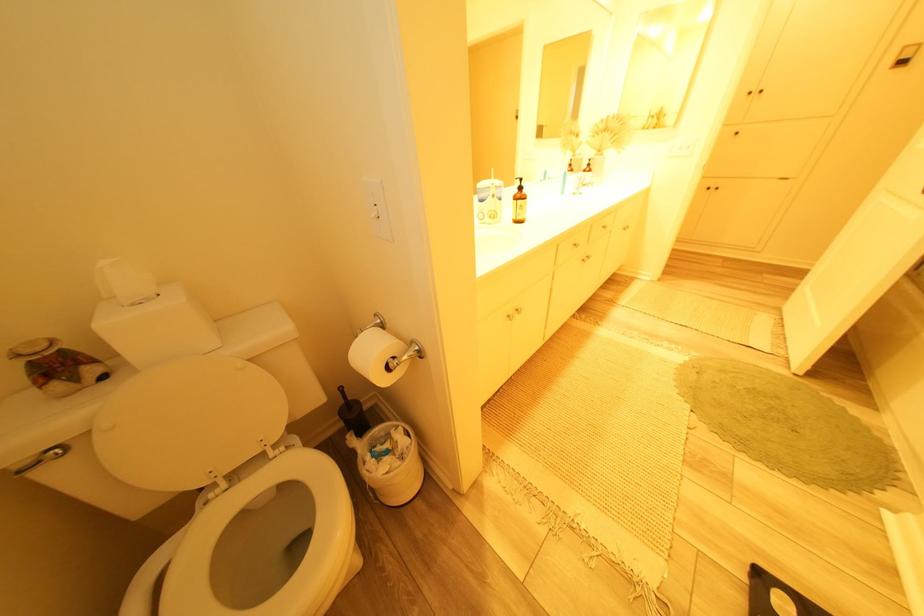
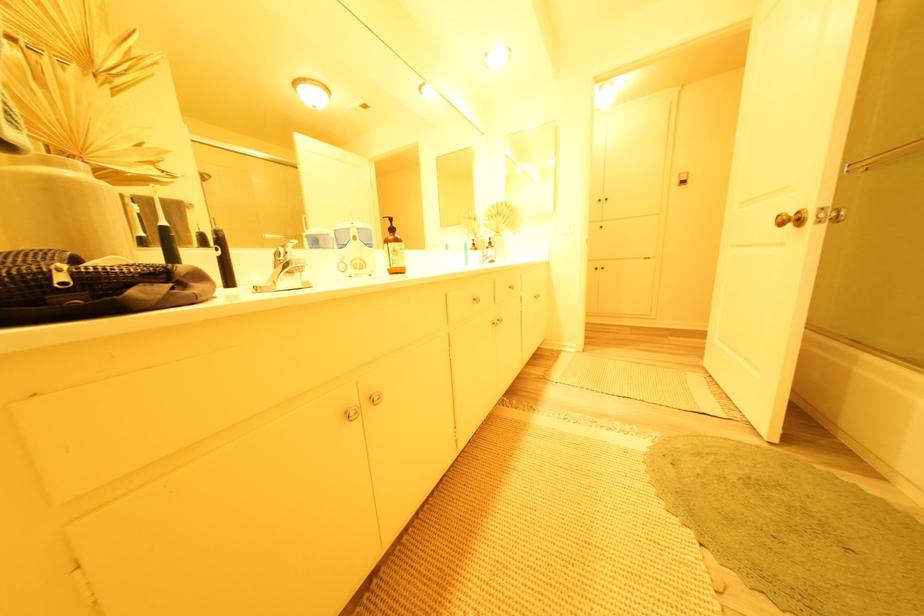
Question: The first image is from the beginning of the video and the second image is from the end. How did the camera likely rotate when shooting the video?

Choices:
 (A) Left
 (B) Right
 (C) Up
 (D) Down

Answer: (C)